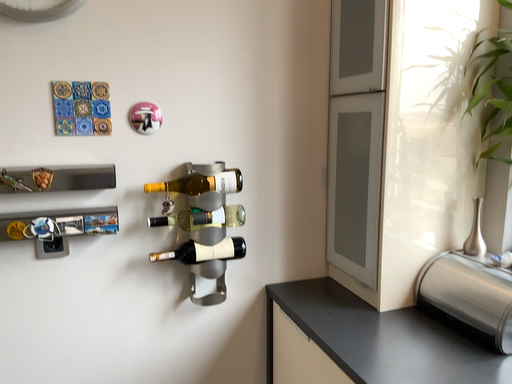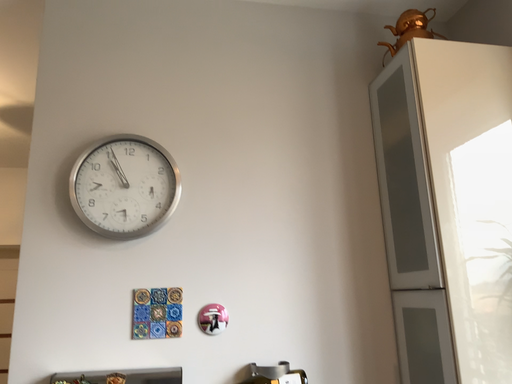
Question: How did the camera likely rotate when shooting the video?

Choices:
 (A) rotated left
 (B) rotated right

Answer: (A)